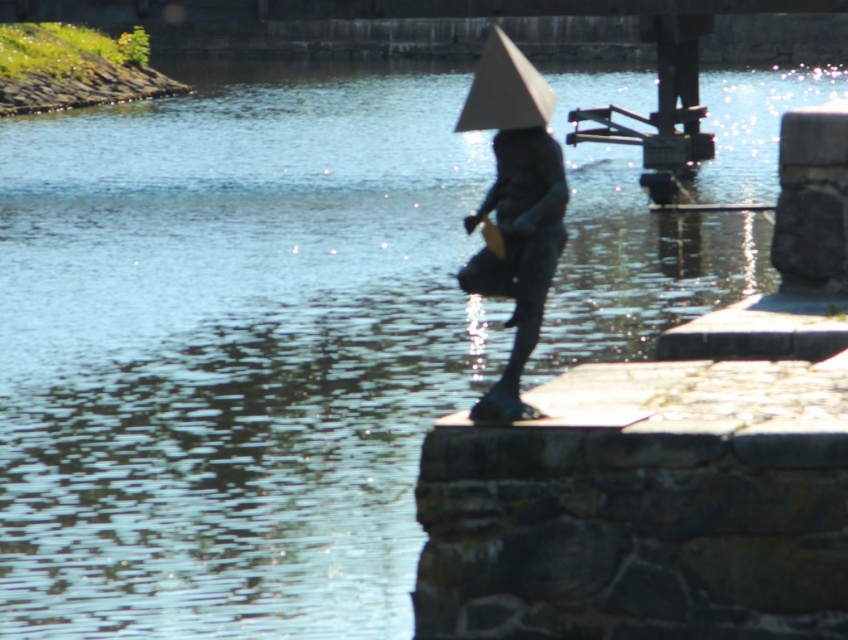
Does shiny bronze statue at center lie behind white paper umbrella at center?

Yes, it is behind white paper umbrella at center.

Between shiny bronze statue at center and white paper umbrella at center, which one has less height?

white paper umbrella at center is shorter.

Describe the element at coordinates (515, 205) in the screenshot. I see `shiny bronze statue at center` at that location.

You are a GUI agent. You are given a task and a screenshot of the screen. Output one action in this format:
    pyautogui.click(x=<x>, y=<y>)
    Task: Click on the shiny bronze statue at center
    
    Given the screenshot: What is the action you would take?
    pyautogui.click(x=515, y=205)